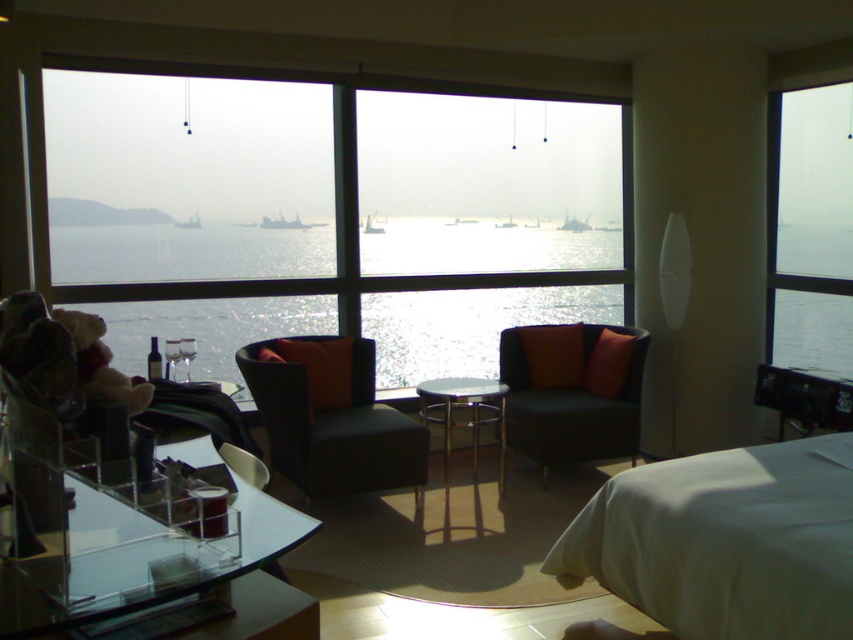
Is white fabric bed at lower right thinner than matte black couch at center?

No, white fabric bed at lower right is not thinner than matte black couch at center.

Is point (799, 600) closer to camera compared to point (567, 456)?

Yes, point (799, 600) is closer to viewer.

Is point (851, 532) less distant than point (520, 451)?

Yes, it is.

I want to click on white fabric bed at lower right, so click(724, 541).

Who is positioned more to the right, transparent glass window at right or black fabric chair at center?

From the viewer's perspective, transparent glass window at right appears more on the right side.

Is transparent glass window at right positioned in front of black fabric chair at center?

That is False.

Locate an element on the screen. This screenshot has width=853, height=640. transparent glass window at right is located at coordinates (810, 228).

Does black fabric chair at center appear under matte black couch at center?

Yes.

Is point (418, 493) farther from camera compared to point (544, 390)?

No.

Find the location of a particular element. Image resolution: width=853 pixels, height=640 pixels. black fabric chair at center is located at coordinates (332, 417).

This screenshot has height=640, width=853. I want to click on black fabric chair at center, so pyautogui.click(x=332, y=417).